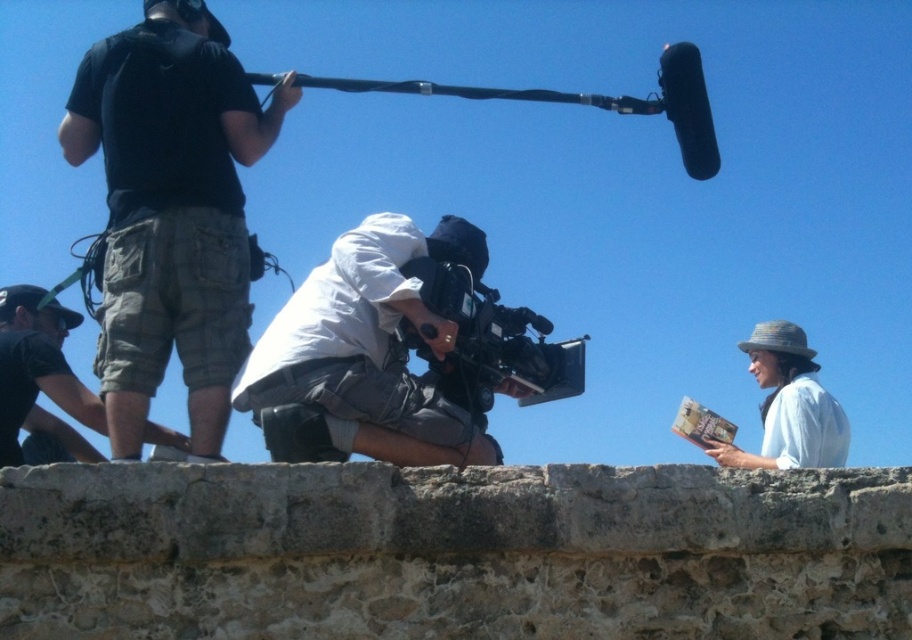
What are the coordinates of the white matte camera at center?

The white matte camera at center is located at coordinates point (x=364, y=355).